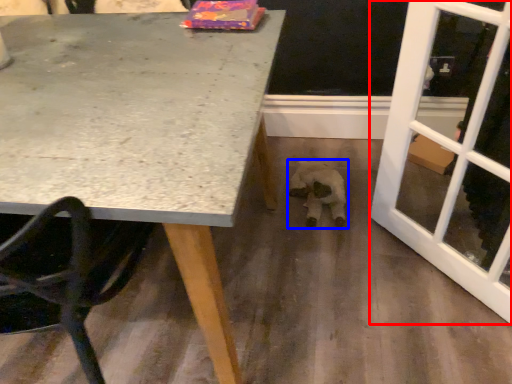
Question: Among these objects, which one is farthest to the camera, screen door (highlighted by a red box) or animal (highlighted by a blue box)?

Choices:
 (A) screen door
 (B) animal

Answer: (B)